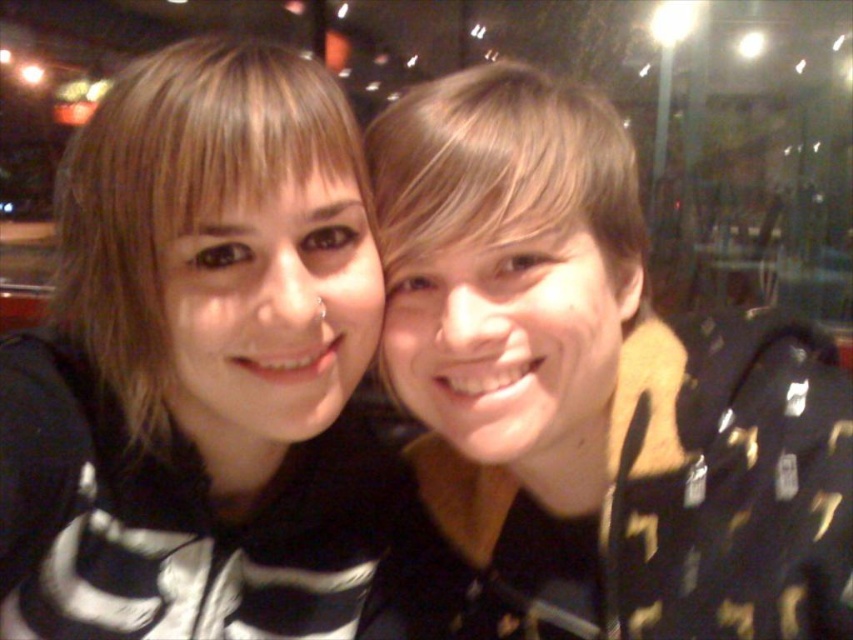
You are taking a photo of two people standing in front of a window in a restaurant. You notice a black matte jacket at right and a black matte hoodie at center. Which clothing item is closer to the right side of the frame?

The black matte jacket at right is positioned on the right side of the black matte hoodie at center, so it is closer to the right side of the frame.

You are standing in a restaurant and see two people taking a selfie. The person on the left is wearing a black and white striped top, and the person on the right is wearing a dark hoodie with lighter patterns. There is a point marked at coordinates (595, 388). Can you tell me what object is located at that point?

The point at coordinates (595, 388) marks the black matte jacket at right.

You are a photographer adjusting the camera settings for a portrait. You notice the black matte jacket at right and the black matte hoodie at center in the frame. Which object should you focus on first if you want to capture the one that is taller?

The black matte jacket at right is taller than the black matte hoodie at center, so you should focus on the black matte jacket at right first.